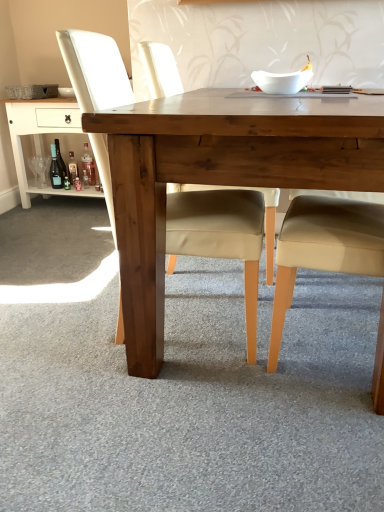
Question: Would you say translucent glass bottle at lower left, which appears as the 2th bottle when viewed from the left, is outside white glossy bowl at upper center?

Choices:
 (A) yes
 (B) no

Answer: (A)

Question: Would you consider translucent glass bottle at lower left, which is the second bottle in right-to-left order, to be distant from white glossy bowl at upper center?

Choices:
 (A) yes
 (B) no

Answer: (A)

Question: Is translucent glass bottle at lower left, which appears as the 2th bottle when viewed from the left, positioned in front of white glossy bowl at upper center?

Choices:
 (A) no
 (B) yes

Answer: (A)

Question: Can you confirm if translucent glass bottle at lower left, which is the second bottle in right-to-left order, is wider than white glossy bowl at upper center?

Choices:
 (A) yes
 (B) no

Answer: (B)

Question: Could you tell me if translucent glass bottle at lower left, which appears as the 2th bottle when viewed from the left, is turned towards white glossy bowl at upper center?

Choices:
 (A) no
 (B) yes

Answer: (A)

Question: Does translucent glass bottle at lower left, which is the second bottle in right-to-left order, contain white glossy bowl at upper center?

Choices:
 (A) no
 (B) yes

Answer: (A)

Question: Is matte glass bottle at lower left, which is counted as the third bottle, starting from the right, wider than matte beige chair at center?

Choices:
 (A) yes
 (B) no

Answer: (B)

Question: Can you confirm if matte glass bottle at lower left, which is counted as the third bottle, starting from the right, is positioned to the left of matte beige chair at center?

Choices:
 (A) yes
 (B) no

Answer: (A)

Question: Is matte beige chair at center completely or partially inside matte glass bottle at lower left, the 1th bottle viewed from the left?

Choices:
 (A) yes
 (B) no

Answer: (B)

Question: From a real-world perspective, does matte glass bottle at lower left, the 1th bottle viewed from the left, stand above matte beige chair at center?

Choices:
 (A) yes
 (B) no

Answer: (B)

Question: Is matte glass bottle at lower left, the 1th bottle viewed from the left, to the right of matte beige chair at center from the viewer's perspective?

Choices:
 (A) no
 (B) yes

Answer: (A)

Question: Could you tell me if matte glass bottle at lower left, the 1th bottle viewed from the left, is facing matte beige chair at center?

Choices:
 (A) yes
 (B) no

Answer: (B)

Question: From the image's perspective, is translucent glass bottle at lower left, which is the second bottle in right-to-left order, on wooden table at lower left?

Choices:
 (A) no
 (B) yes

Answer: (A)